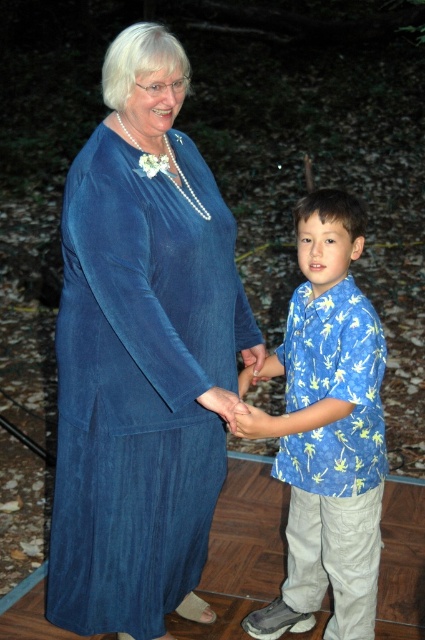
You are a photographer standing 1.5 meters away from the camera. You want to adjust the focus on the velvet blue dress at center. Can you reach the dress without moving closer to it?

The velvet blue dress at center and camera are 1.91 meters apart. Since you are 1.5 meters away from the camera, the total distance between you and the dress is 1.91m minus 1.5m equals 0.41 meters. Therefore, you can easily reach the dress without moving closer.

You are an artist trying to draw this scene. You need to decide which object to sketch first based on size. Which one should you start with, the blue printed shirt at center or the matte blue hand at center?

The blue printed shirt at center is bigger than the matte blue hand at center, so you should start with the blue printed shirt at center first.